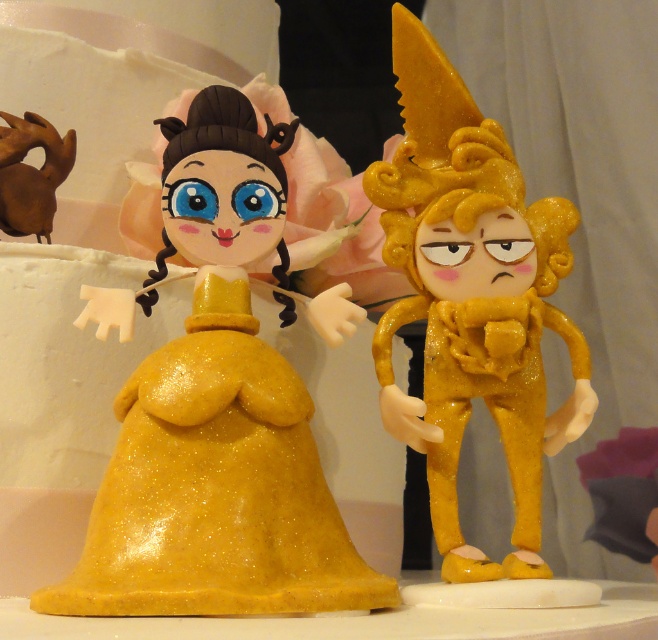
You are a guest at a birthday party and want to take a photo with the cake. You need to stand between the glittery gold dress at center and the glittery gold figure at right. Can you fit in the space between them?

The glittery gold dress at center is to the left of the glittery gold figure at right, so yes, you can fit between them as there is space between the two objects.

You are a baker who needs to place a ribbon between the glittery gold dress at center and the glittery gold figure at right on the cake. The ribbon is 4.5 inches long. Will it be long enough to span the gap between them?

The distance between the glittery gold dress at center and the glittery gold figure at right is 5.05 inches. Since the ribbon is only 4.5 inches long, it will not be long enough to span the gap between them.